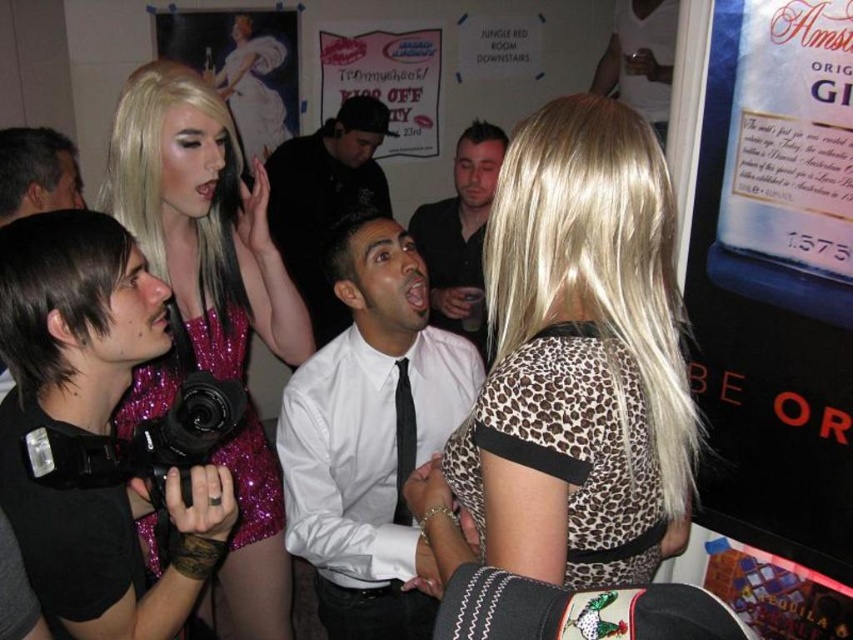
You are at a party and need to decide which item is taller between the leopard print dress at center and the black plastic video camera at lower left. Based on the scene description, which one is taller?

The leopard print dress at center is taller than the black plastic video camera at lower left according to the scene description.

Please look at the image and find the point with coordinates (325, 198). Which object in the image does this point lie on?

The point with coordinates (325, 198) lies on the white shirt at center.